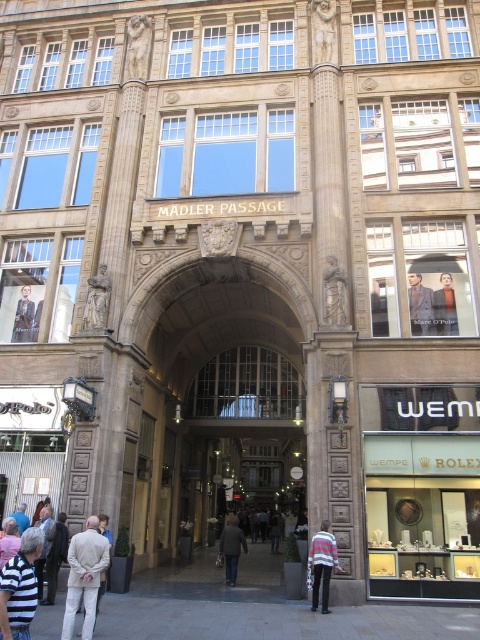
Question: From the image, what is the correct spatial relationship of striped sweater at center in relation to smooth leather jacket at center?

Choices:
 (A) above
 (B) below

Answer: (B)

Question: Is light beige fabric jacket at lower left closer to camera compared to matte black jacket at upper left?

Choices:
 (A) yes
 (B) no

Answer: (A)

Question: Which of the following is the farthest from the observer?

Choices:
 (A) (455, 333)
 (B) (321, 548)

Answer: (A)

Question: Which point is closer to the camera?

Choices:
 (A) [107, 288]
 (B) [235, 547]
 (C) [454, 308]
 (D) [51, 600]

Answer: (D)

Question: Which point is farther from the camera taking this photo?

Choices:
 (A) (325, 531)
 (B) (72, 621)
 (C) (232, 531)

Answer: (C)

Question: Can you confirm if striped cotton shirt at lower left is thinner than striped fabric jacket at lower left?

Choices:
 (A) no
 (B) yes

Answer: (A)